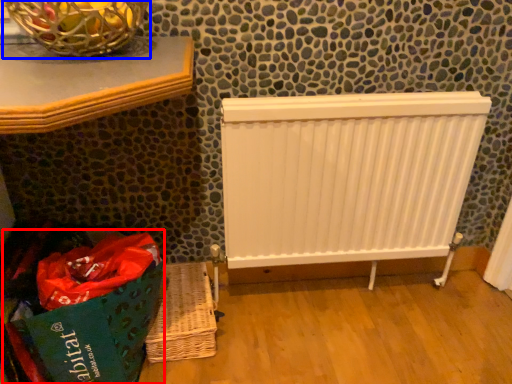
Question: Among these objects, which one is nearest to the camera, shopping bag (highlighted by a red box) or basket container (highlighted by a blue box)?

Choices:
 (A) shopping bag
 (B) basket container

Answer: (B)